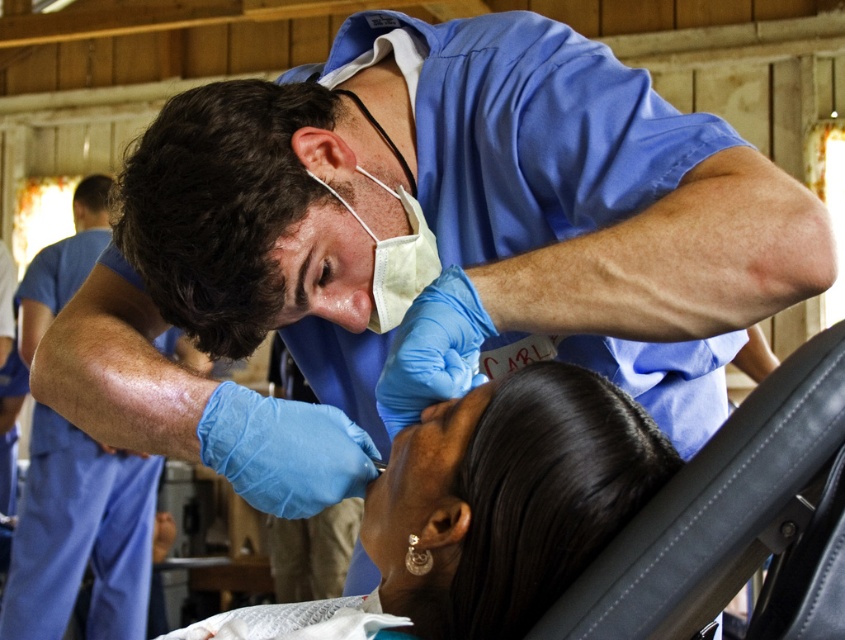
Is smooth skin face at center above white matte mask at upper center?

No, smooth skin face at center is not above white matte mask at upper center.

Does smooth skin face at center have a lesser width compared to white matte mask at upper center?

Incorrect, smooth skin face at center's width is not less than white matte mask at upper center's.

Does point (462, 630) come in front of point (422, 276)?

Yes, point (462, 630) is closer to viewer.

At what (x,y) coordinates should I click in order to perform the action: click on smooth skin face at center. Please return your answer as a coordinate pair (x, y). Looking at the image, I should click on (488, 512).